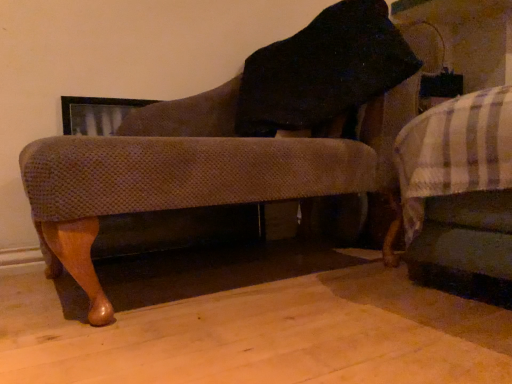
You are a GUI agent. You are given a task and a screenshot of the screen. Output one action in this format:
    pyautogui.click(x=<x>, y=<y>)
    Task: Click on the vacant space underneath textured fabric chair at center (from a real-world perspective)
    The image size is (512, 384).
    Given the screenshot: What is the action you would take?
    pyautogui.click(x=238, y=271)